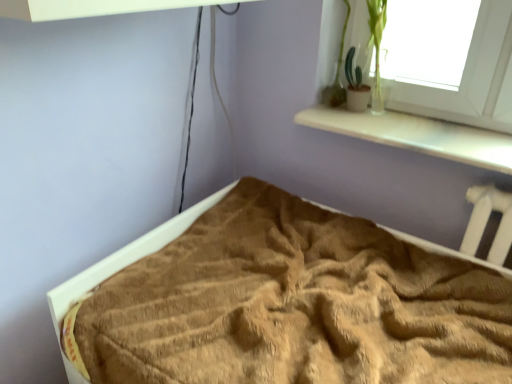
Question: Is green matte plant at upper right positioned beyond the bounds of brown textured blanket at lower center?

Choices:
 (A) yes
 (B) no

Answer: (A)

Question: Is green matte plant at upper right facing away from brown textured blanket at lower center?

Choices:
 (A) yes
 (B) no

Answer: (B)

Question: Does green matte plant at upper right have a greater height compared to brown textured blanket at lower center?

Choices:
 (A) yes
 (B) no

Answer: (A)

Question: Considering the relative positions of green matte plant at upper right and brown textured blanket at lower center in the image provided, is green matte plant at upper right behind brown textured blanket at lower center?

Choices:
 (A) yes
 (B) no

Answer: (A)

Question: Does green matte plant at upper right have a greater width compared to brown textured blanket at lower center?

Choices:
 (A) no
 (B) yes

Answer: (A)

Question: Can you confirm if green matte plant at upper right is bigger than brown textured blanket at lower center?

Choices:
 (A) no
 (B) yes

Answer: (A)

Question: From a real-world perspective, does brown textured blanket at lower center stand above green matte plant at upper right?

Choices:
 (A) no
 (B) yes

Answer: (A)

Question: From the image's perspective, is brown textured blanket at lower center located above green matte plant at upper right?

Choices:
 (A) yes
 (B) no

Answer: (B)

Question: Does brown textured blanket at lower center contain green matte plant at upper right?

Choices:
 (A) yes
 (B) no

Answer: (B)

Question: Is brown textured blanket at lower center facing towards green matte plant at upper right?

Choices:
 (A) no
 (B) yes

Answer: (A)

Question: Is brown textured blanket at lower center at the left side of green matte plant at upper right?

Choices:
 (A) no
 (B) yes

Answer: (B)

Question: Does brown textured blanket at lower center appear on the right side of green matte plant at upper right?

Choices:
 (A) yes
 (B) no

Answer: (B)

Question: Does point (354, 92) appear closer or farther from the camera than point (87, 273)?

Choices:
 (A) closer
 (B) farther

Answer: (B)